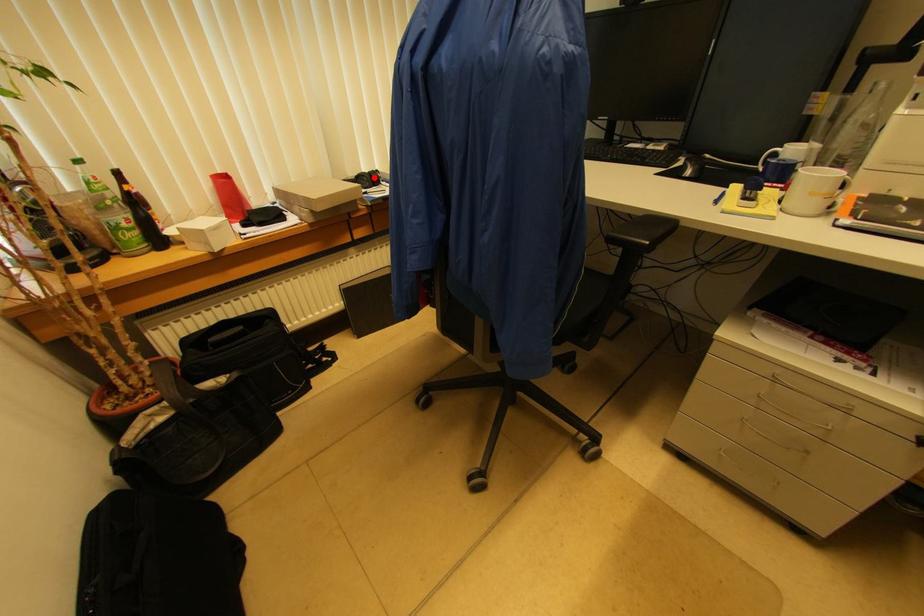
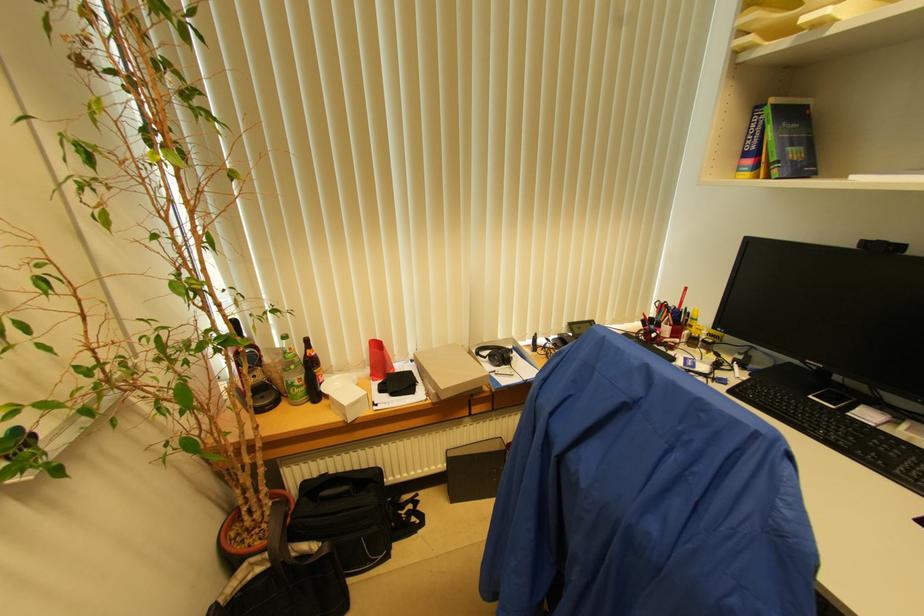
Locate, in the second image, the point that corresponds to the highlighted location in the first image.

(506, 358)